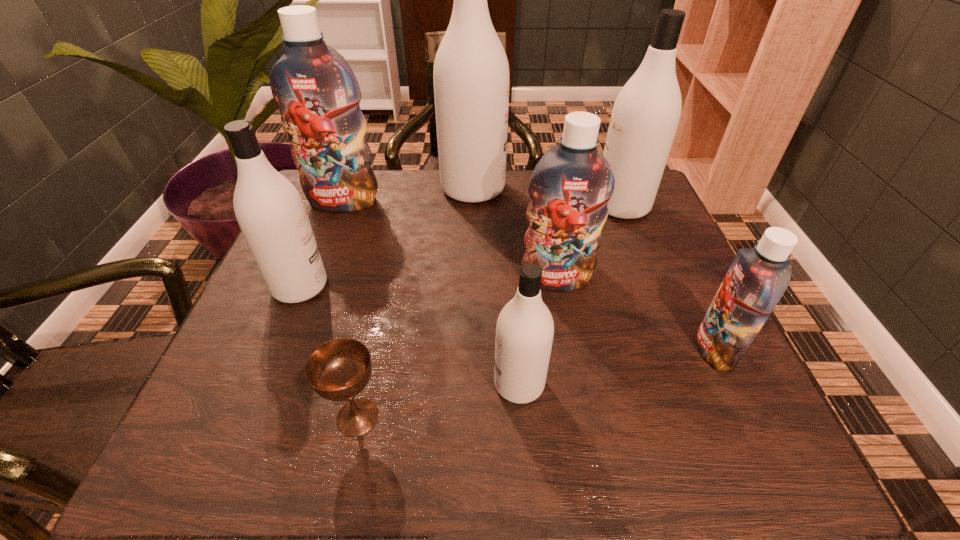
What are the coordinates of `the tallest object` in the screenshot? It's located at (471, 74).

Identify the location of the biggest white shampoo. Image resolution: width=960 pixels, height=540 pixels. (471, 74).

The image size is (960, 540). Find the location of `the third smallest white shampoo`. the third smallest white shampoo is located at coordinates (645, 116).

The height and width of the screenshot is (540, 960). Find the location of `the leftmost blue shampoo`. the leftmost blue shampoo is located at coordinates (318, 95).

This screenshot has height=540, width=960. I want to click on the farthest blue shampoo, so click(318, 95).

Identify the location of the leftmost white shampoo. Image resolution: width=960 pixels, height=540 pixels. (271, 214).

This screenshot has height=540, width=960. I want to click on the third biggest white shampoo, so click(x=271, y=214).

Where is `the second smallest blue shampoo`? This screenshot has height=540, width=960. the second smallest blue shampoo is located at coordinates (570, 187).

Where is `the second blue shampoo from left to right`? The image size is (960, 540). the second blue shampoo from left to right is located at coordinates (570, 187).

The image size is (960, 540). I want to click on the rightmost blue shampoo, so click(x=757, y=278).